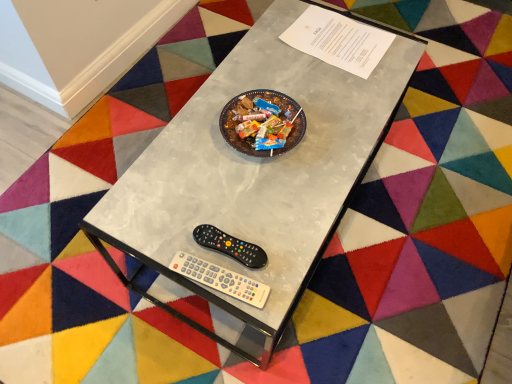
Question: From a real-world perspective, does white plastic wii controller at lower center sit lower than metallic gray table at center?

Choices:
 (A) no
 (B) yes

Answer: (A)

Question: Would you say white plastic wii controller at lower center is outside metallic gray table at center?

Choices:
 (A) yes
 (B) no

Answer: (B)

Question: Is white plastic wii controller at lower center bigger than metallic gray table at center?

Choices:
 (A) no
 (B) yes

Answer: (A)

Question: Is white plastic wii controller at lower center oriented away from metallic gray table at center?

Choices:
 (A) no
 (B) yes

Answer: (B)

Question: Is white plastic wii controller at lower center in front of metallic gray table at center?

Choices:
 (A) no
 (B) yes

Answer: (A)

Question: From a real-world perspective, is black plastic remote at lower center above or below metallic gray table at center?

Choices:
 (A) above
 (B) below

Answer: (A)

Question: Considering the positions of black plastic remote at lower center and metallic gray table at center in the image, is black plastic remote at lower center taller or shorter than metallic gray table at center?

Choices:
 (A) tall
 (B) short

Answer: (B)

Question: In the image, is black plastic remote at lower center positioned in front of or behind metallic gray table at center?

Choices:
 (A) front
 (B) behind

Answer: (B)

Question: Is black plastic remote at lower center wider or thinner than metallic gray table at center?

Choices:
 (A) wide
 (B) thin

Answer: (B)

Question: Looking at the image, does white plastic wii controller at lower center seem bigger or smaller compared to black plastic remote at lower center?

Choices:
 (A) small
 (B) big

Answer: (A)

Question: Would you say white plastic wii controller at lower center is to the left or to the right of black plastic remote at lower center in the picture?

Choices:
 (A) left
 (B) right

Answer: (A)

Question: From their relative heights in the image, would you say white plastic wii controller at lower center is taller or shorter than black plastic remote at lower center?

Choices:
 (A) short
 (B) tall

Answer: (A)

Question: Is point (182, 269) positioned closer to the camera than point (219, 230)?

Choices:
 (A) closer
 (B) farther

Answer: (A)

Question: Would you say metallic gray table at center is to the left or to the right of black plastic remote at lower center in the picture?

Choices:
 (A) left
 (B) right

Answer: (B)

Question: Looking at the image, does metallic gray table at center seem bigger or smaller compared to black plastic remote at lower center?

Choices:
 (A) big
 (B) small

Answer: (A)